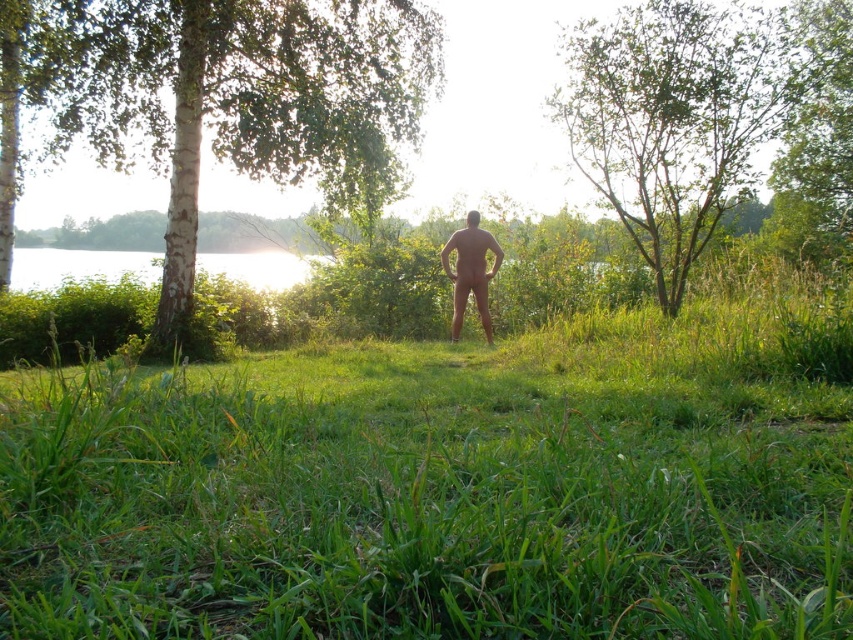
Based on the photo, you are standing at the point marked as point (213, 97) in the image. What is the nearest object to you?

The nearest object to you is the white bark tree at left, as the point (213, 97) is located on it.

You are navigating a drone that must fly from point A to point B in the scene. Point A is at coordinates point (53, 77) and point B is at coordinates point (718, 195). Given that the drone can only fly over the grassy area, can you confirm if the path between these two points is clear?

Point (53, 77) is behind point (718, 195), so the path between them is clear over the grassy area. The drone can safely fly from point (53, 77) to point (718, 195).